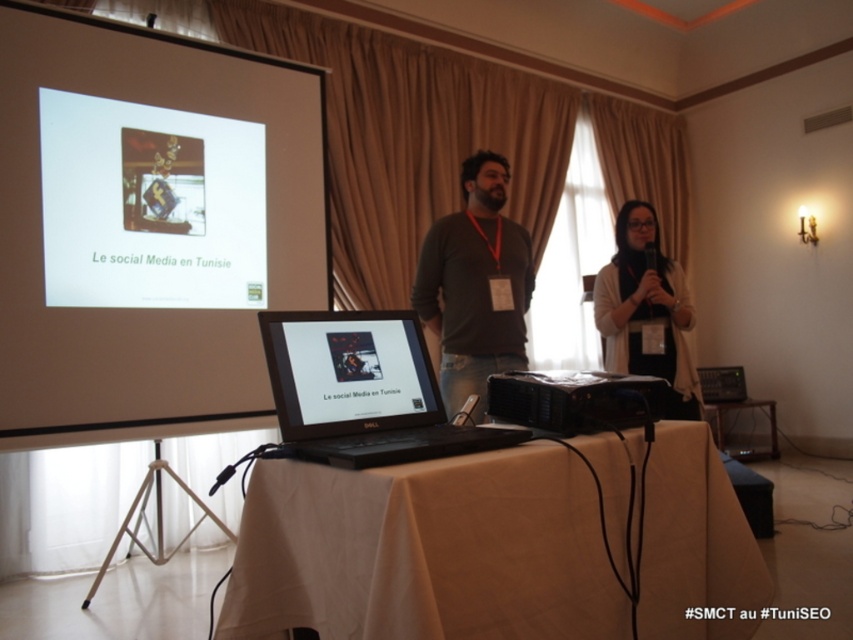
Question: Which of these objects is positioned farthest from the black plastic projector at center?

Choices:
 (A) black plastic laptop at center
 (B) black matte laptop at center
 (C) dark gray long-sleeve shirt at center
 (D) black leather speaker at lower right

Answer: (A)

Question: Which point is closer to the camera?

Choices:
 (A) black plastic laptop at center
 (B) white cloth-covered table at center
 (C) dark gray long-sleeve shirt at center

Answer: (B)

Question: Can you confirm if black plastic laptop at center is positioned above wooden table at center?

Choices:
 (A) no
 (B) yes

Answer: (B)

Question: Does black matte laptop at center appear on the left side of black leather speaker at lower right?

Choices:
 (A) yes
 (B) no

Answer: (A)

Question: Does white matte projection screen at upper left lie behind matte black laptop at center?

Choices:
 (A) yes
 (B) no

Answer: (A)

Question: Which object is the closest to the black plastic laptop at center?

Choices:
 (A) black matte laptop at center
 (B) dark gray long-sleeve shirt at center
 (C) white matte projection screen at upper left
 (D) white fabric jacket at center

Answer: (D)